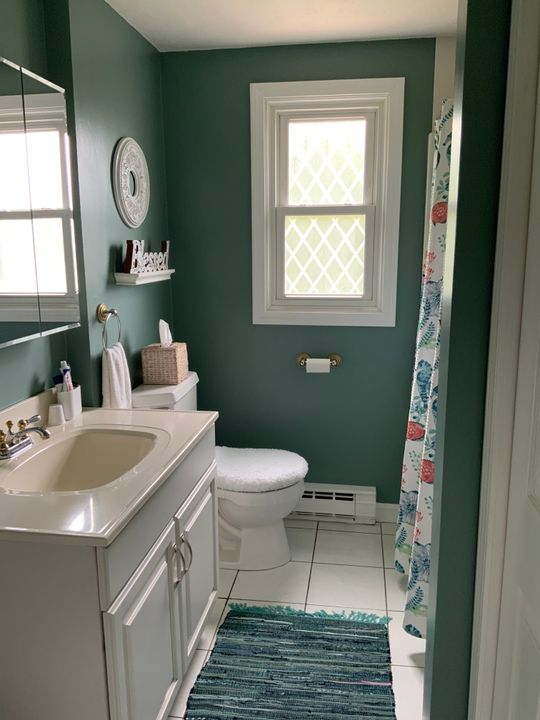
Identify the location of 1 vent. This screenshot has width=540, height=720. (335, 502).